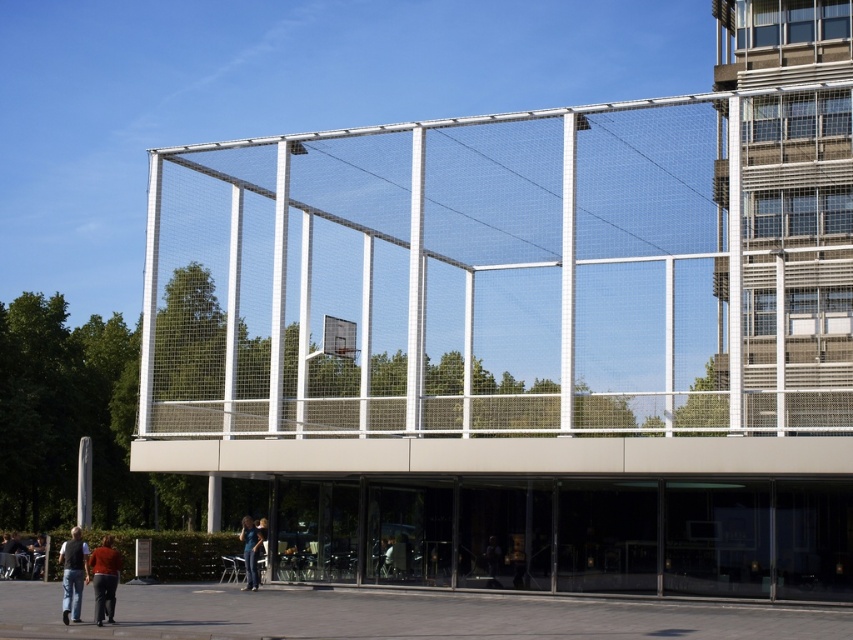
You are standing at the entrance of the building and want to locate two specific points on the facade. The first point is at coordinates point [343,333] and the second is at point [488,563]. Which point is closer to you when viewed from the entrance?

Point [488,563] is closer to you because point [343,333] is behind it.

Consider the image. You are an observer standing in front of the modern architectural structure with the basketball hoop. You notice a matte red shirt at lower left and a denim jacket at lower center. Which object is closer to you?

The matte red shirt at lower left is closer to you because it is in front of the denim jacket at lower center.

You are a photographer standing in front of the modern architectural structure with the basketball hoop. You want to take a photo that includes both the point at coordinates point (70, 532) and point (96, 550). Which point is closer to your camera lens?

Point (70, 532) is closer to the camera lens than point (96, 550) because it is further to the camera than the other point.